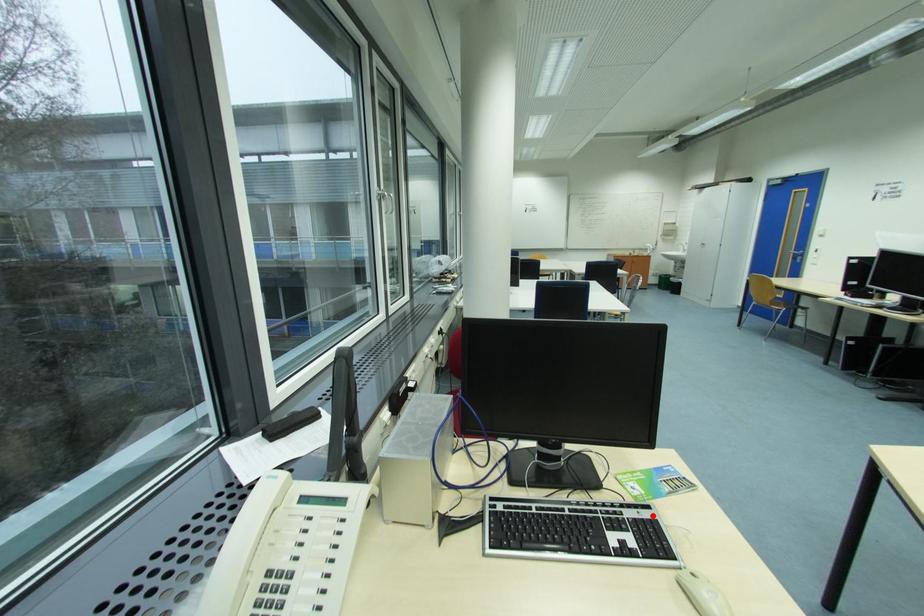
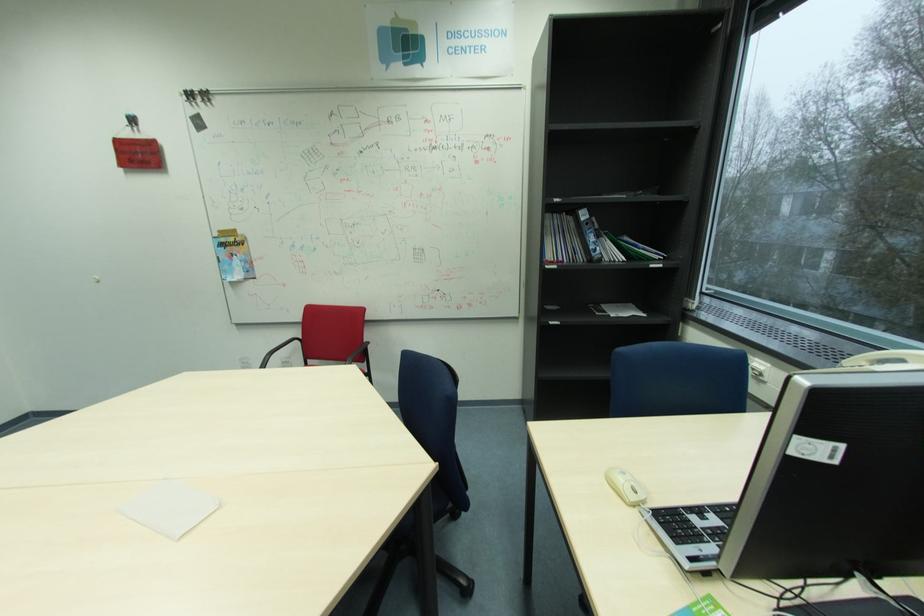
Find the pixel in the second image that matches the highlighted location in the first image.

(699, 551)